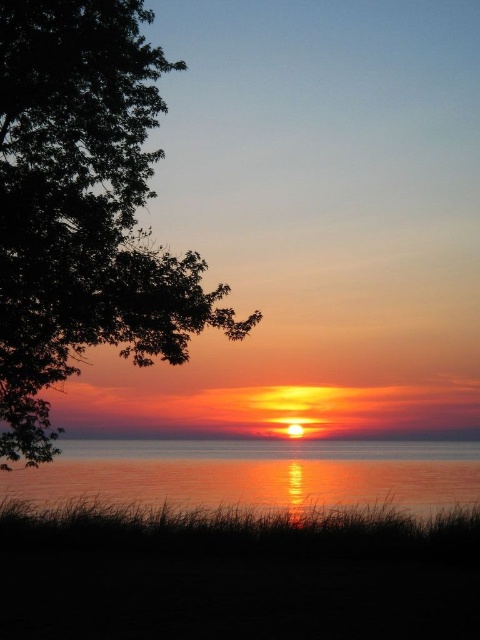
Question: Is green leafy tree at left positioned in front of smooth glass water at center?

Choices:
 (A) yes
 (B) no

Answer: (A)

Question: Which of the following is the farthest from the observer?

Choices:
 (A) green leafy tree at left
 (B) smooth glass water at center

Answer: (B)

Question: Does green leafy tree at left appear under smooth glass water at center?

Choices:
 (A) yes
 (B) no

Answer: (B)

Question: Is green leafy tree at left smaller than smooth glass water at center?

Choices:
 (A) no
 (B) yes

Answer: (A)